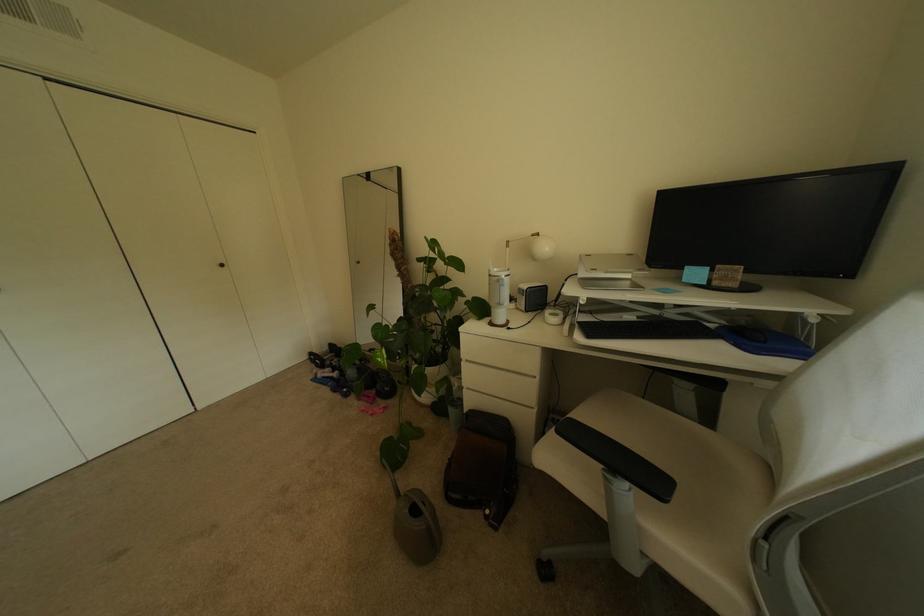
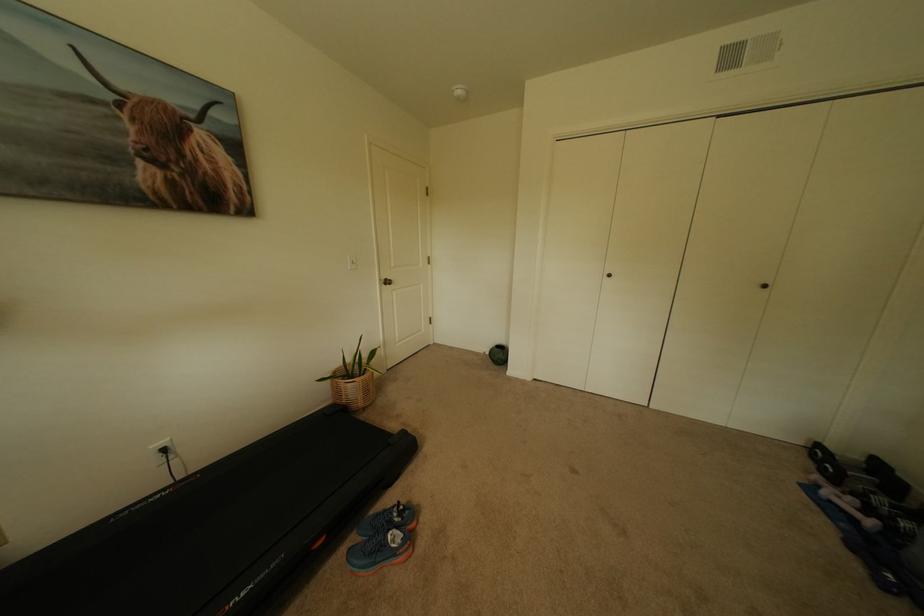
In the second image, find the point that corresponds to the point at 341,379 in the first image.

(862, 521)